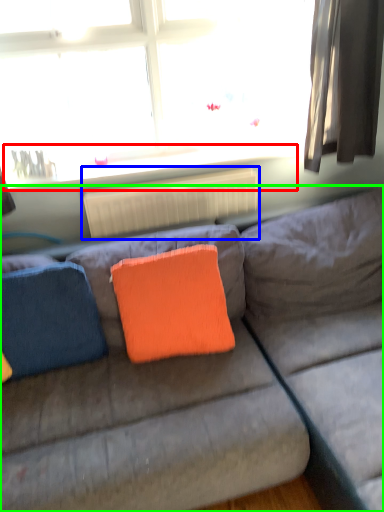
Question: Which object is the closest to the window sill (highlighted by a red box)? Choose among these: radiator (highlighted by a blue box) or studio couch (highlighted by a green box).

Choices:
 (A) radiator
 (B) studio couch

Answer: (A)